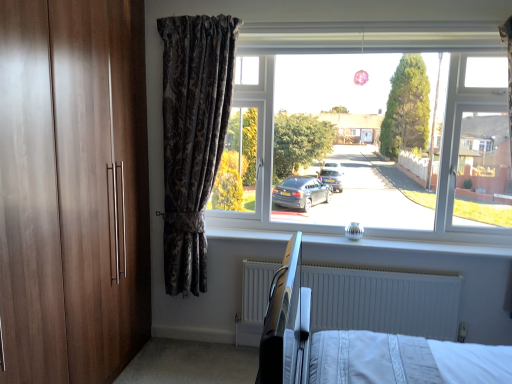
Question: Should I look upward or downward to see white textured radiator at lower center?

Choices:
 (A) up
 (B) down

Answer: (B)

Question: Is the position of white textured radiator at lower center less distant than that of transparent glass window at center?

Choices:
 (A) no
 (B) yes

Answer: (A)

Question: Are white textured radiator at lower center and transparent glass window at center making contact?

Choices:
 (A) yes
 (B) no

Answer: (B)

Question: Does white textured radiator at lower center have a smaller size compared to transparent glass window at center?

Choices:
 (A) yes
 (B) no

Answer: (A)

Question: Does white textured radiator at lower center appear on the right side of transparent glass window at center?

Choices:
 (A) yes
 (B) no

Answer: (B)

Question: From the image's perspective, is white textured radiator at lower center over transparent glass window at center?

Choices:
 (A) no
 (B) yes

Answer: (A)

Question: Can you confirm if white textured radiator at lower center is wider than transparent glass window at center?

Choices:
 (A) yes
 (B) no

Answer: (B)

Question: From a real-world perspective, is white textured radiator at lower center physically above dark floral fabric curtain at center?

Choices:
 (A) yes
 (B) no

Answer: (B)

Question: Does white textured radiator at lower center come behind dark floral fabric curtain at center?

Choices:
 (A) no
 (B) yes

Answer: (B)

Question: Does white textured radiator at lower center come in front of dark floral fabric curtain at center?

Choices:
 (A) no
 (B) yes

Answer: (A)

Question: From the image's perspective, is white textured radiator at lower center over dark floral fabric curtain at center?

Choices:
 (A) yes
 (B) no

Answer: (B)

Question: Is white textured radiator at lower center at the left side of dark floral fabric curtain at center?

Choices:
 (A) no
 (B) yes

Answer: (A)

Question: From the image's perspective, is white textured radiator at lower center under dark floral fabric curtain at center?

Choices:
 (A) yes
 (B) no

Answer: (A)

Question: From the image's perspective, is metallic hospital bed at center beneath transparent glass window at center?

Choices:
 (A) no
 (B) yes

Answer: (B)